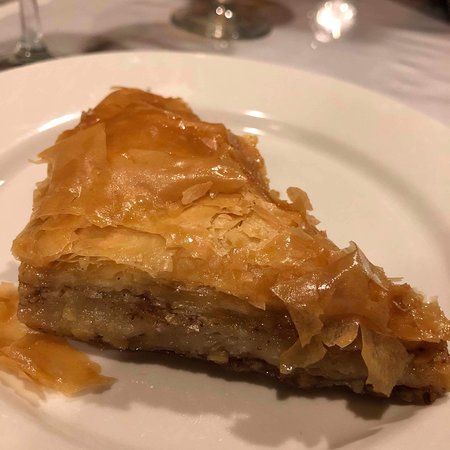
Find the location of a particular element. The image size is (450, 450). spot between glass bases on table is located at coordinates (116, 39).